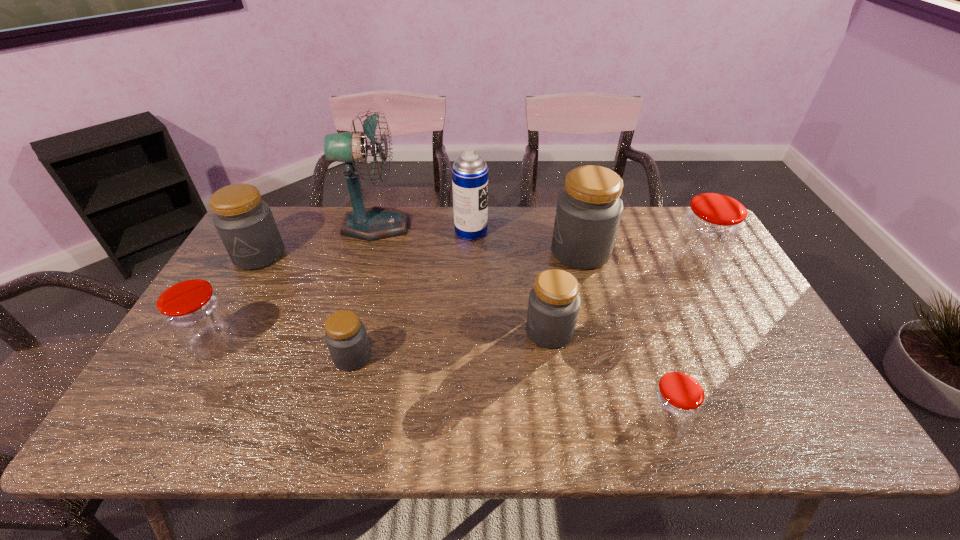
This screenshot has width=960, height=540. What are the coordinates of `object that is at the near edge` in the screenshot? It's located at (676, 400).

Find the location of a particular element. object positioned at the right edge is located at coordinates (708, 232).

At what (x,y) coordinates should I click in order to perform the action: click on object that is at the far left corner. Please return your answer as a coordinate pair (x, y). Looking at the image, I should click on (245, 223).

Identify the location of vacant space at the far edge of the desktop. The height and width of the screenshot is (540, 960). (621, 238).

The height and width of the screenshot is (540, 960). What are the coordinates of `vacant area at the right edge of the desktop` in the screenshot? It's located at coord(751,315).

This screenshot has height=540, width=960. In the image, there is a desktop. Identify the location of vacant space at the far right corner. pos(671,206).

Locate an element on the screen. The image size is (960, 540). vacant area between the third biggest gray jar and the second farthest red jar is located at coordinates (382, 338).

You are a GUI agent. You are given a task and a screenshot of the screen. Output one action in this format:
    pyautogui.click(x=<x>, y=<y>)
    Task: Click on the vacant area that lies between the leftmost red jar and the rightmost red jar
    This screenshot has height=540, width=960.
    Given the screenshot: What is the action you would take?
    pyautogui.click(x=454, y=306)

This screenshot has height=540, width=960. I want to click on free space between the smallest gray jar and the smallest red jar, so click(508, 390).

Image resolution: width=960 pixels, height=540 pixels. I want to click on blank region between the third jar from left to right and the biggest gray jar, so click(467, 305).